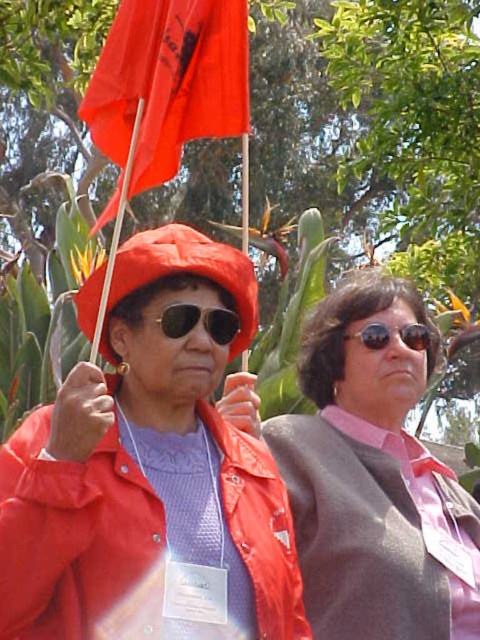
You are a photographer trying to capture a clear photo of the matte red hat at upper left and the pink satin blouse at center. Since you want to focus on the hat, which object should you adjust your camera to focus on first, considering their heights?

The matte red hat at upper left has a lesser height compared to the pink satin blouse at center, so you should focus on the pink satin blouse at center first to ensure proper focus depth.

You are taking a photo of two people at an event. You notice two points on their clothing accessories. The first point is at coordinate point(x=178, y=348) and the second is at point(x=233, y=125). If you want to focus on the point that is closer to your camera, which coordinate should you choose?

You should focus on point(x=178, y=348) because it is closer to the camera than point(x=233, y=125).